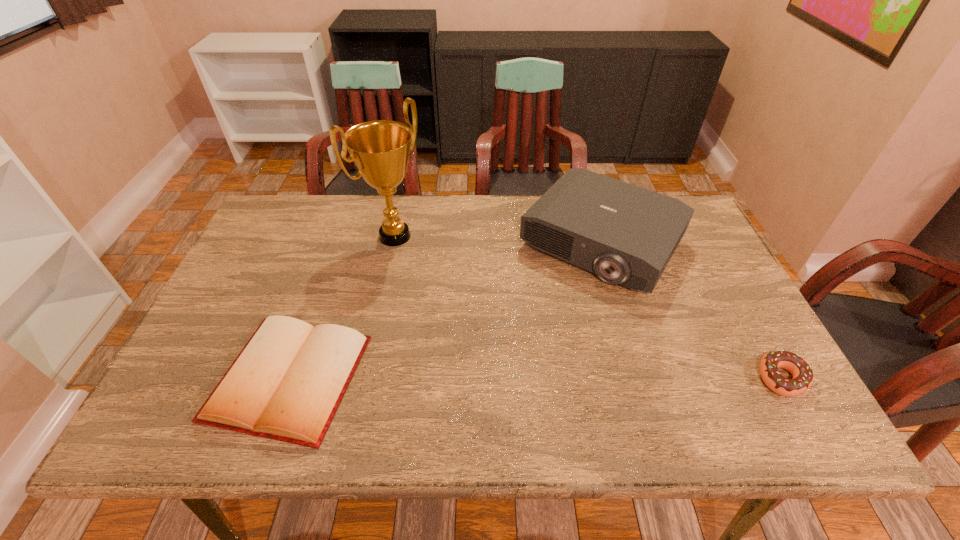
Find the location of `vacant space on the desktop that is between the Bible and the doughnut and is positioned on the front view with handles of the award`. vacant space on the desktop that is between the Bible and the doughnut and is positioned on the front view with handles of the award is located at coordinates (587, 378).

Locate an element on the screen. Image resolution: width=960 pixels, height=540 pixels. free space on the desktop that is between the Bible and the rightmost object and is positioned on the front-facing side of the second tallest object is located at coordinates 500,378.